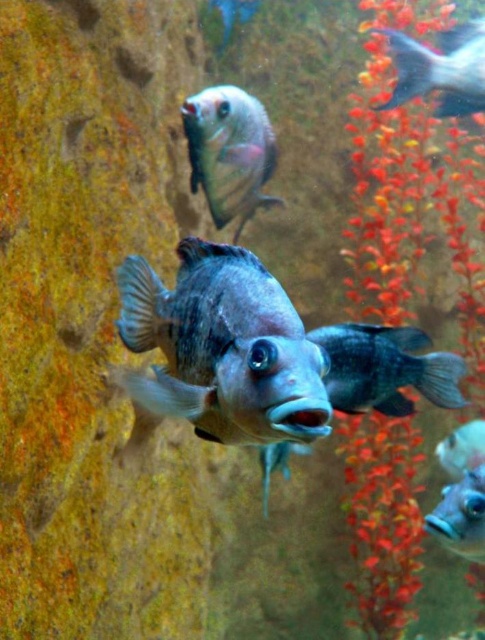
You are an underwater photographer aiming to capture the shiny silver fish at upper right. Based on its position, where should you aim your camera to ensure it is centered in your shot?

You should aim your camera at point (440, 68) to center the shiny silver fish at upper right in your shot.

You are an underwater photographer aiming to capture a closeup of the fish near the rock. You have two points marked in the scene, point A at coordinates point (x=436, y=380) and point B at coordinates point (x=463, y=465). Which point should you position your camera closer to for a clearer shot of the fish?

Point A at coordinates point (x=436, y=380) is closer to the viewer than point B at coordinates point (x=463, y=465), so positioning the camera closer to point A would provide a clearer shot of the fish.

You are an underwater photographer aiming to capture a photo of the blue glossy fish at center and the satin silver fish at lower right. From your current position, which fish is positioned to the right side of the other?

The satin silver fish at lower right is positioned to the right of the blue glossy fish at center.